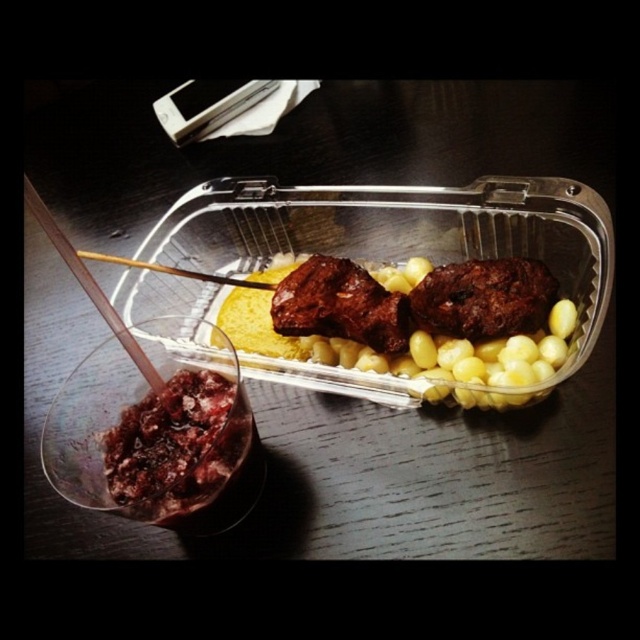
From the picture: You are sitting at a table and want to reach for the item closer to you between the two points labeled point (170,481) and point (260,284). Which point should you reach for?

You should reach for point (170,481) because it is in front of point (260,284), meaning it is closer to you.

You are a food delivery person who needs to determine if the brown matte meatballs at center can fit under the wooden chopstick at left when stacking. Can they?

The brown matte meatballs at center has a greater height compared to wooden chopstick at left, so they cannot fit under the wooden chopstick at left because the meatballs are taller than the chopstick.